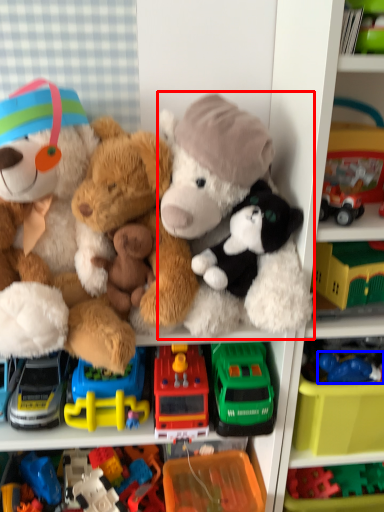
Question: Which of the following is the farthest to the observer, teddy bear (highlighted by a red box) or toy (highlighted by a blue box)?

Choices:
 (A) teddy bear
 (B) toy

Answer: (B)